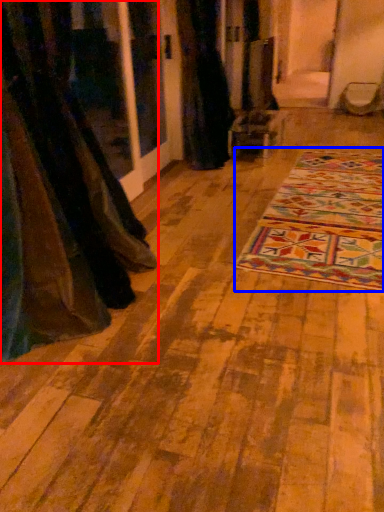
Question: Which of the following is the farthest to the observer, curtain (highlighted by a red box) or mat (highlighted by a blue box)?

Choices:
 (A) curtain
 (B) mat

Answer: (B)